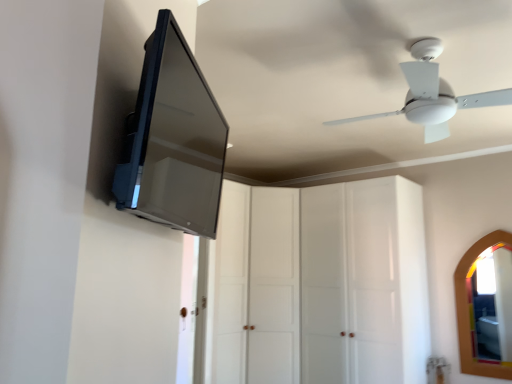
Identify the location of white glossy cabinet at center, marked as the 1th glass door in a right-to-left arrangement. (350, 284).

Where is `transparent glass cabinet at center, arranged as the 2th glass door when viewed from the right`? transparent glass cabinet at center, arranged as the 2th glass door when viewed from the right is located at coordinates (257, 286).

Find the location of a particular element. This screenshot has width=512, height=384. white glossy cabinet at center, marked as the 1th glass door in a right-to-left arrangement is located at coordinates (350, 284).

Can you tell me how much wooden-framed mirror at right and white glossy cabinet at center, marked as the 2th glass door in a left-to-right arrangement, differ in facing direction?

There is a 0.00121-degree angle between the facing directions of wooden-framed mirror at right and white glossy cabinet at center, marked as the 2th glass door in a left-to-right arrangement.

Do you think wooden-framed mirror at right is within white glossy cabinet at center, marked as the 1th glass door in a right-to-left arrangement, or outside of it?

wooden-framed mirror at right is not enclosed by white glossy cabinet at center, marked as the 1th glass door in a right-to-left arrangement.

Is wooden-framed mirror at right placed right next to white glossy cabinet at center, marked as the 1th glass door in a right-to-left arrangement?

They are not placed beside each other.

Can you tell me how much wooden-framed mirror at right and satin black tv at upper left differ in facing direction?

125 degrees separate the facing orientations of wooden-framed mirror at right and satin black tv at upper left.

Considering the relative sizes of wooden-framed mirror at right and satin black tv at upper left in the image provided, is wooden-framed mirror at right wider than satin black tv at upper left?

No.

Between wooden-framed mirror at right and satin black tv at upper left, which one appears on the left side from the viewer's perspective?

Positioned to the left is satin black tv at upper left.

How much distance is there between wooden-framed mirror at right and satin black tv at upper left?

wooden-framed mirror at right is 3.22 meters away from satin black tv at upper left.

Is satin black tv at upper left in contact with wooden-framed mirror at right?

No, satin black tv at upper left is not with wooden-framed mirror at right.

Is satin black tv at upper left facing towards wooden-framed mirror at right?

No, satin black tv at upper left is not oriented towards wooden-framed mirror at right.

Between satin black tv at upper left and wooden-framed mirror at right, which one appears on the right side from the viewer's perspective?

wooden-framed mirror at right.

From the image's perspective, would you say satin black tv at upper left is shown under wooden-framed mirror at right?

No, from the image's perspective, satin black tv at upper left is not beneath wooden-framed mirror at right.

Would you say transparent glass cabinet at center, arranged as the 2th glass door when viewed from the right, is inside or outside wooden-framed mirror at right?

transparent glass cabinet at center, arranged as the 2th glass door when viewed from the right, cannot be found inside wooden-framed mirror at right.

Between transparent glass cabinet at center, arranged as the 2th glass door when viewed from the right, and wooden-framed mirror at right, which one has larger width?

Wider between the two is transparent glass cabinet at center, arranged as the 2th glass door when viewed from the right.

Which is in front, transparent glass cabinet at center, which is counted as the first glass door, starting from the left, or wooden-framed mirror at right?

transparent glass cabinet at center, which is counted as the first glass door, starting from the left, is closer to the camera.

Based on their sizes in the image, would you say transparent glass cabinet at center, which is counted as the first glass door, starting from the left, is bigger or smaller than wooden-framed mirror at right?

Considering their sizes, transparent glass cabinet at center, which is counted as the first glass door, starting from the left, takes up more space than wooden-framed mirror at right.

From a real-world perspective, is transparent glass cabinet at center, arranged as the 2th glass door when viewed from the right, physically located above or below white plastic ceiling fan at upper right?

From a real-world perspective, transparent glass cabinet at center, arranged as the 2th glass door when viewed from the right, is physically below white plastic ceiling fan at upper right.

Considering the points (233, 190) and (437, 98), which point is behind, point (233, 190) or point (437, 98)?

The point (233, 190) is behind.

Would you say white plastic ceiling fan at upper right is part of transparent glass cabinet at center, which is counted as the first glass door, starting from the left,'s contents?

That's incorrect, white plastic ceiling fan at upper right is not inside transparent glass cabinet at center, which is counted as the first glass door, starting from the left.

Is transparent glass cabinet at center, arranged as the 2th glass door when viewed from the right, thinner than white plastic ceiling fan at upper right?

Correct, the width of transparent glass cabinet at center, arranged as the 2th glass door when viewed from the right, is less than that of white plastic ceiling fan at upper right.

Would you consider wooden-framed mirror at right to be distant from white plastic ceiling fan at upper right?

wooden-framed mirror at right is far away from white plastic ceiling fan at upper right.

Who is shorter, wooden-framed mirror at right or white plastic ceiling fan at upper right?

With less height is white plastic ceiling fan at upper right.

Looking at this image, between wooden-framed mirror at right and white plastic ceiling fan at upper right, which one has larger width?

white plastic ceiling fan at upper right.

How far apart are wooden-framed mirror at right and white plastic ceiling fan at upper right?

wooden-framed mirror at right is 7.03 feet away from white plastic ceiling fan at upper right.

Is white glossy cabinet at center, marked as the 2th glass door in a left-to-right arrangement, positioned beyond the bounds of satin black tv at upper left?

Yes.

From the image's perspective, is white glossy cabinet at center, marked as the 1th glass door in a right-to-left arrangement, over satin black tv at upper left?

No, from the image's perspective, white glossy cabinet at center, marked as the 1th glass door in a right-to-left arrangement, is not above satin black tv at upper left.

Is point (340, 186) in front of point (164, 58)?

No, it is behind (164, 58).

Is white glossy cabinet at center, marked as the 1th glass door in a right-to-left arrangement, not near satin black tv at upper left?

Absolutely, white glossy cabinet at center, marked as the 1th glass door in a right-to-left arrangement, is distant from satin black tv at upper left.

Locate an element on the screen. mirror below the white glossy cabinet at center, marked as the 1th glass door in a right-to-left arrangement (from the image's perspective) is located at coordinates (469, 311).

Find the location of a particular element. The image size is (512, 384). mirror located underneath the satin black tv at upper left (from a real-world perspective) is located at coordinates (469, 311).

From the picture: From the image, which object appears to be farther from white glossy cabinet at center, marked as the 2th glass door in a left-to-right arrangement, satin black tv at upper left or wooden-framed mirror at right?

satin black tv at upper left.

Based on the photo, which object lies further to the anchor point white glossy cabinet at center, marked as the 2th glass door in a left-to-right arrangement, transparent glass cabinet at center, arranged as the 2th glass door when viewed from the right, or satin black tv at upper left?

satin black tv at upper left.

Which object lies nearer to the anchor point wooden-framed mirror at right, white glossy cabinet at center, marked as the 2th glass door in a left-to-right arrangement, or transparent glass cabinet at center, arranged as the 2th glass door when viewed from the right?

Among the two, white glossy cabinet at center, marked as the 2th glass door in a left-to-right arrangement, is located nearer to wooden-framed mirror at right.

When comparing their distances from transparent glass cabinet at center, arranged as the 2th glass door when viewed from the right, does white glossy cabinet at center, marked as the 2th glass door in a left-to-right arrangement, or satin black tv at upper left seem further?

Based on the image, satin black tv at upper left appears to be further to transparent glass cabinet at center, arranged as the 2th glass door when viewed from the right.

Estimate the real-world distances between objects in this image. Which object is closer to wooden-framed mirror at right, white plastic ceiling fan at upper right or white glossy cabinet at center, marked as the 2th glass door in a left-to-right arrangement?

white glossy cabinet at center, marked as the 2th glass door in a left-to-right arrangement, is positioned closer to the anchor wooden-framed mirror at right.

Based on the photo, when comparing their distances from wooden-framed mirror at right, does white glossy cabinet at center, marked as the 1th glass door in a right-to-left arrangement, or white plastic ceiling fan at upper right seem further?

Based on the image, white plastic ceiling fan at upper right appears to be further to wooden-framed mirror at right.

Considering their positions, is satin black tv at upper left positioned closer to wooden-framed mirror at right than white glossy cabinet at center, marked as the 1th glass door in a right-to-left arrangement?

white glossy cabinet at center, marked as the 1th glass door in a right-to-left arrangement, lies closer to wooden-framed mirror at right than the other object.

Looking at the image, which one is located closer to white plastic ceiling fan at upper right, white glossy cabinet at center, marked as the 2th glass door in a left-to-right arrangement, or transparent glass cabinet at center, arranged as the 2th glass door when viewed from the right?

Based on the image, white glossy cabinet at center, marked as the 2th glass door in a left-to-right arrangement, appears to be nearer to white plastic ceiling fan at upper right.

At what (x,y) coordinates should I click in order to perform the action: click on glass door positioned between white plastic ceiling fan at upper right and transparent glass cabinet at center, arranged as the 2th glass door when viewed from the right, from near to far. Please return your answer as a coordinate pair (x, y). The image size is (512, 384). Looking at the image, I should click on (350, 284).

The width and height of the screenshot is (512, 384). In order to click on ceiling fan between satin black tv at upper left and transparent glass cabinet at center, which is counted as the first glass door, starting from the left, from front to back in this screenshot , I will do `click(433, 94)`.

In order to click on ceiling fan between satin black tv at upper left and wooden-framed mirror at right in the front-back direction in this screenshot , I will do `click(433, 94)`.

Where is `glass door between satin black tv at upper left and transparent glass cabinet at center, arranged as the 2th glass door when viewed from the right, from front to back`? This screenshot has height=384, width=512. glass door between satin black tv at upper left and transparent glass cabinet at center, arranged as the 2th glass door when viewed from the right, from front to back is located at coordinates (350, 284).